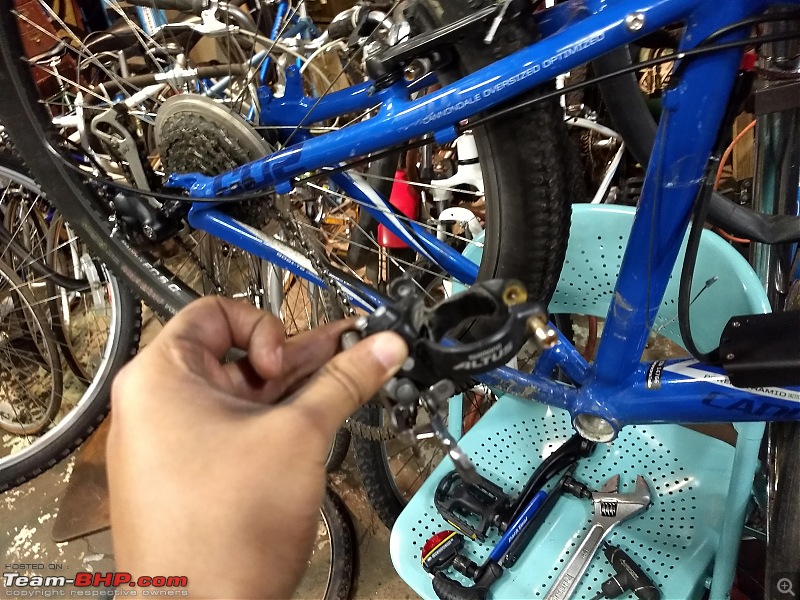
The width and height of the screenshot is (800, 600). What are the coordinates of `floor` in the screenshot? It's located at (26, 548).